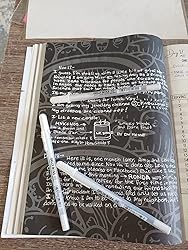
You are a GUI agent. You are given a task and a screenshot of the screen. Output one action in this format:
    pyautogui.click(x=<x>, y=<y>)
    Task: Click on the three pens
    This screenshot has height=250, width=188.
    Given the screenshot: What is the action you would take?
    [x=108, y=190], [x=58, y=193], [x=65, y=99]